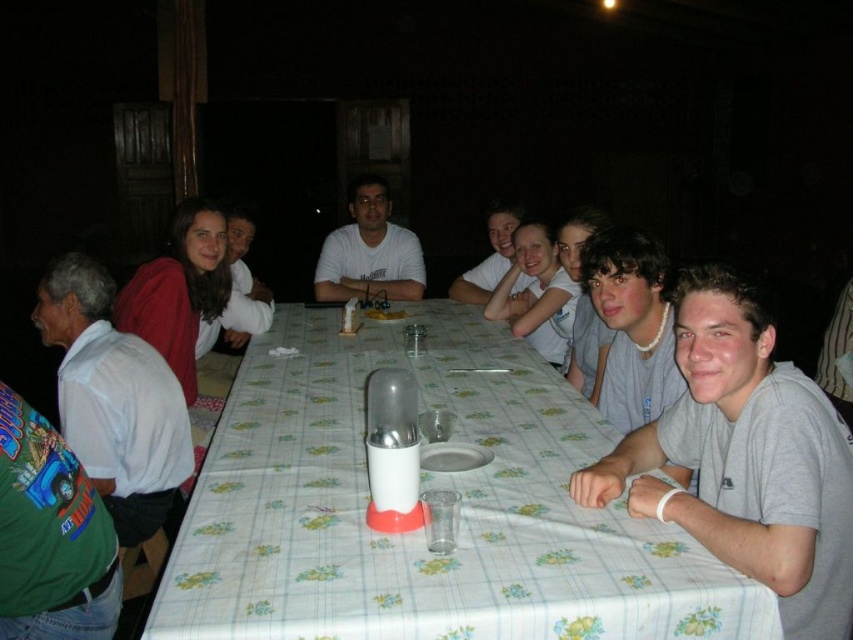
Question: Is green cotton shirt at lower left to the left of matte white shirt at upper center from the viewer's perspective?

Choices:
 (A) no
 (B) yes

Answer: (A)

Question: Among these points, which one is nearest to the camera?

Choices:
 (A) (96, 624)
 (B) (299, 499)
 (C) (357, 216)
 (D) (228, 236)

Answer: (A)

Question: Which point is farther from the camera taking this photo?

Choices:
 (A) (329, 236)
 (B) (100, 300)
 (C) (33, 620)
 (D) (468, 301)

Answer: (A)

Question: Does white fabric table at center appear on the right side of matte white shirt at upper center?

Choices:
 (A) yes
 (B) no

Answer: (A)

Question: Can you confirm if white matte shirt at center is smaller than smooth white shirt at center?

Choices:
 (A) yes
 (B) no

Answer: (B)

Question: Which object is the closest to the matte white shirt at upper center?

Choices:
 (A) gray cotton t-shirt at center
 (B) smooth white shirt at center
 (C) white matte shirt at center
 (D) green cotton shirt at lower left

Answer: (C)